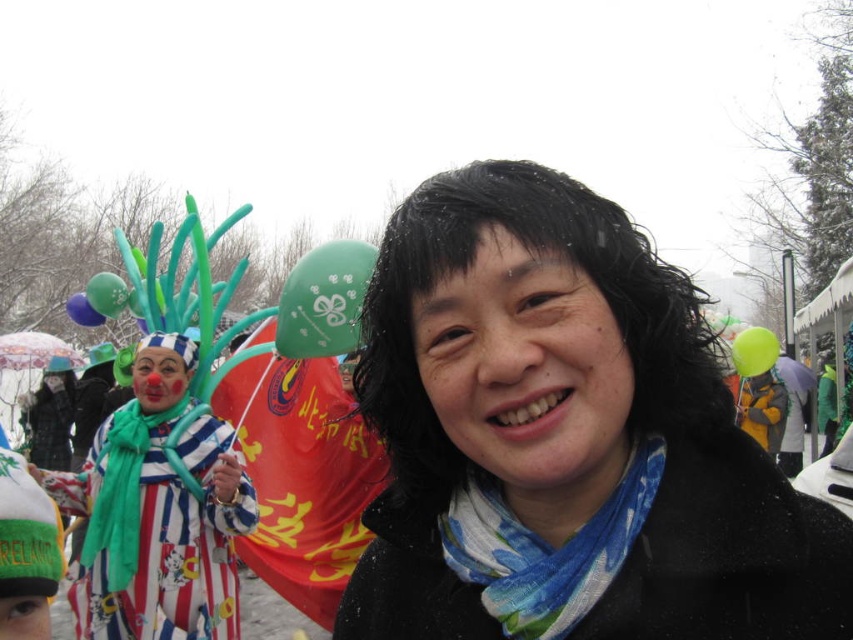
Between point (314, 323) and point (766, 346), which one is positioned behind?

The point (766, 346) is more distant.

Who is positioned more to the right, green matte balloon at upper center or green rubber balloon at right?

green rubber balloon at right is more to the right.

What do you see at coordinates (323, 300) in the screenshot?
I see `green matte balloon at upper center` at bounding box center [323, 300].

Locate an element on the screen. The image size is (853, 640). green matte balloon at upper center is located at coordinates (323, 300).

Can you confirm if black matte scarf at center is positioned below green rubber balloon at right?

Incorrect, black matte scarf at center is not positioned below green rubber balloon at right.

Can you confirm if black matte scarf at center is smaller than green rubber balloon at right?

Incorrect, black matte scarf at center is not smaller in size than green rubber balloon at right.

Identify the location of black matte scarf at center. 567,424.

Identify the location of black matte scarf at center. (567, 424).

At what (x,y) coordinates should I click in order to perform the action: click on green rubber balloon at right. Please return your answer as a coordinate pair (x, y). Looking at the image, I should click on pyautogui.click(x=753, y=349).

Who is taller, green rubber balloon at right or matte blue balloon at upper left?

green rubber balloon at right

Measure the distance between green rubber balloon at right and camera.

A distance of 9.27 meters exists between green rubber balloon at right and camera.

Where is `green rubber balloon at right`? Image resolution: width=853 pixels, height=640 pixels. green rubber balloon at right is located at coordinates (753, 349).